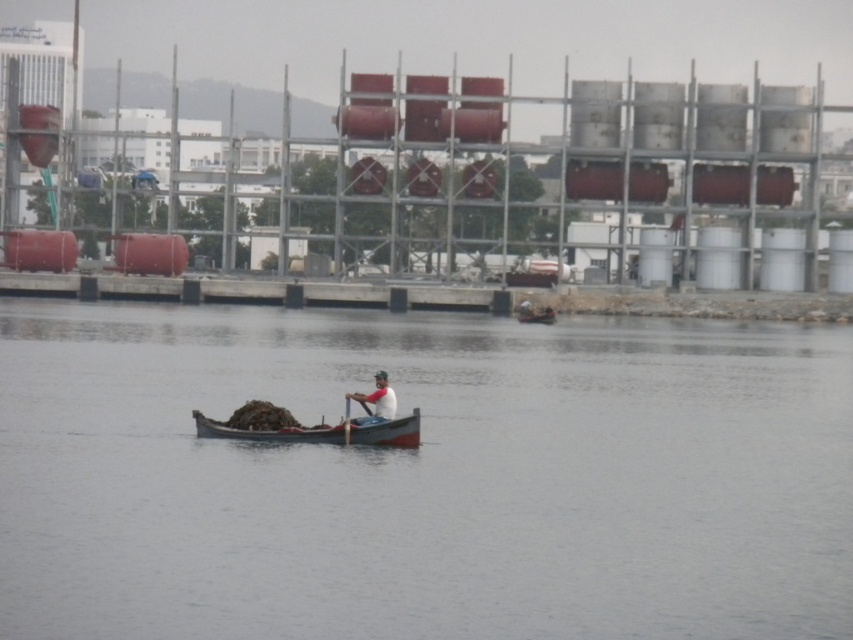
Question: Is clear water at center wider than white matte shirt at center?

Choices:
 (A) yes
 (B) no

Answer: (A)

Question: Which is nearer to the white matte shirt at center?

Choices:
 (A) wooden boat at center
 (B) wooden canoe at center
 (C) clear water at center

Answer: (A)

Question: Which point appears farthest from the camera in this image?

Choices:
 (A) pos(392,438)
 (B) pos(329,340)
 (C) pos(366,417)

Answer: (B)

Question: Can you confirm if wooden boat at center is positioned below white matte shirt at center?

Choices:
 (A) yes
 (B) no

Answer: (A)

Question: Which point is farther from the camera taking this photo?

Choices:
 (A) [x=387, y=397]
 (B) [x=635, y=403]
 (C) [x=317, y=426]

Answer: (B)

Question: Observing the image, what is the correct spatial positioning of white matte shirt at center in reference to wooden canoe at center?

Choices:
 (A) above
 (B) below

Answer: (B)